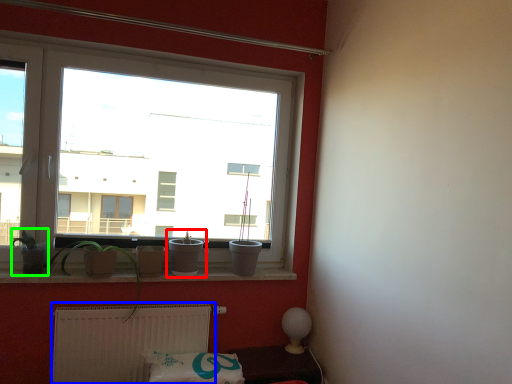
Question: Which object is positioned closest to houseplant (highlighted by a red box)? Select from radiator (highlighted by a blue box) and plant (highlighted by a green box).

Choices:
 (A) radiator
 (B) plant

Answer: (A)